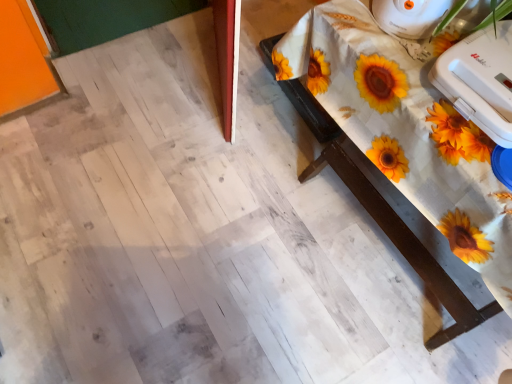
I want to click on vacant space to the left of white wood table at upper right, so click(195, 208).